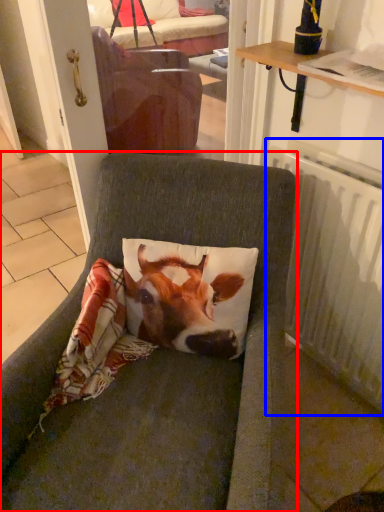
Question: Among these objects, which one is nearest to the camera, chair (highlighted by a red box) or radiator (highlighted by a blue box)?

Choices:
 (A) chair
 (B) radiator

Answer: (A)